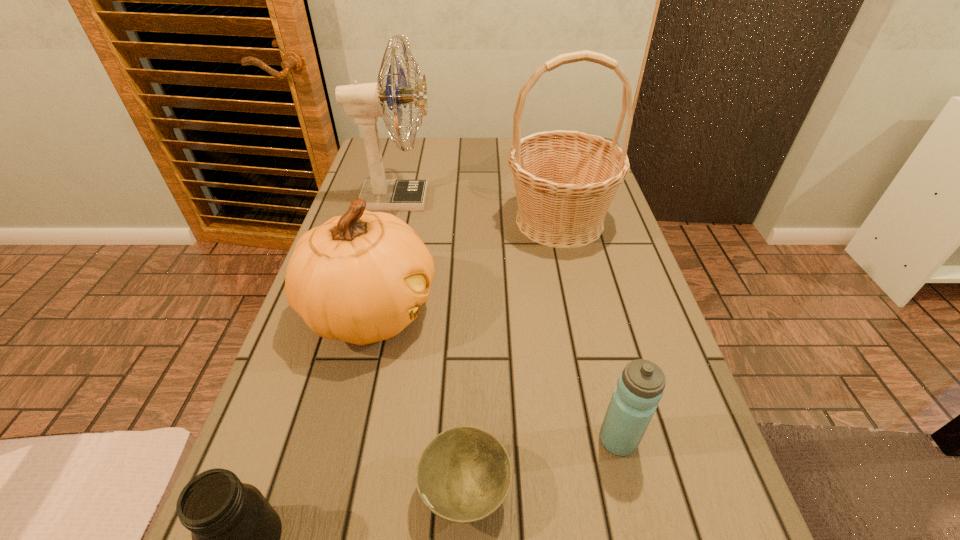
You are a GUI agent. You are given a task and a screenshot of the screen. Output one action in this format:
    pyautogui.click(x=<x>, y=<y>)
    Task: Click on the basket
    
    Given the screenshot: What is the action you would take?
    pyautogui.click(x=565, y=181)

Locate an element on the screen. fan is located at coordinates (365, 102).

Where is `the third farthest object`? This screenshot has height=540, width=960. the third farthest object is located at coordinates (360, 278).

Locate an element on the screen. This screenshot has width=960, height=540. pumpkin is located at coordinates (360, 278).

The height and width of the screenshot is (540, 960). In order to click on water bottle in this screenshot , I will do `click(640, 387)`.

In order to click on free spot located on the back of the basket in this screenshot , I will do `click(541, 138)`.

Locate an element on the screen. The height and width of the screenshot is (540, 960). vacant area situated on the front-facing side of the fan is located at coordinates (519, 199).

You are a GUI agent. You are given a task and a screenshot of the screen. Output one action in this format:
    pyautogui.click(x=<x>, y=<y>)
    Task: Click on the vacant space situated on the front face of the pumpkin
    The height and width of the screenshot is (540, 960).
    Given the screenshot: What is the action you would take?
    pyautogui.click(x=529, y=311)

Where is `free space located on the right of the water bottle`? This screenshot has width=960, height=540. free space located on the right of the water bottle is located at coordinates (690, 440).

This screenshot has width=960, height=540. Find the location of `fan at the left edge`. fan at the left edge is located at coordinates (365, 102).